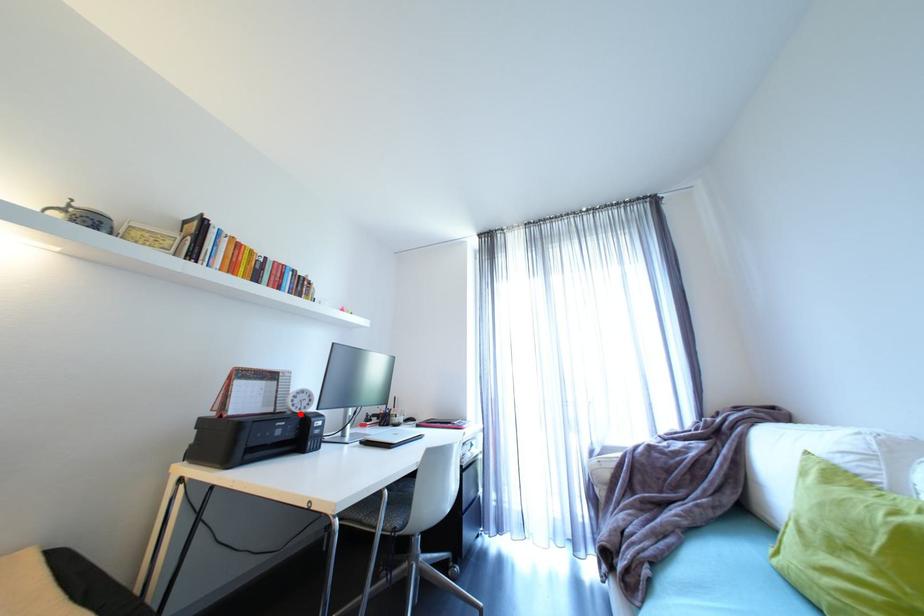
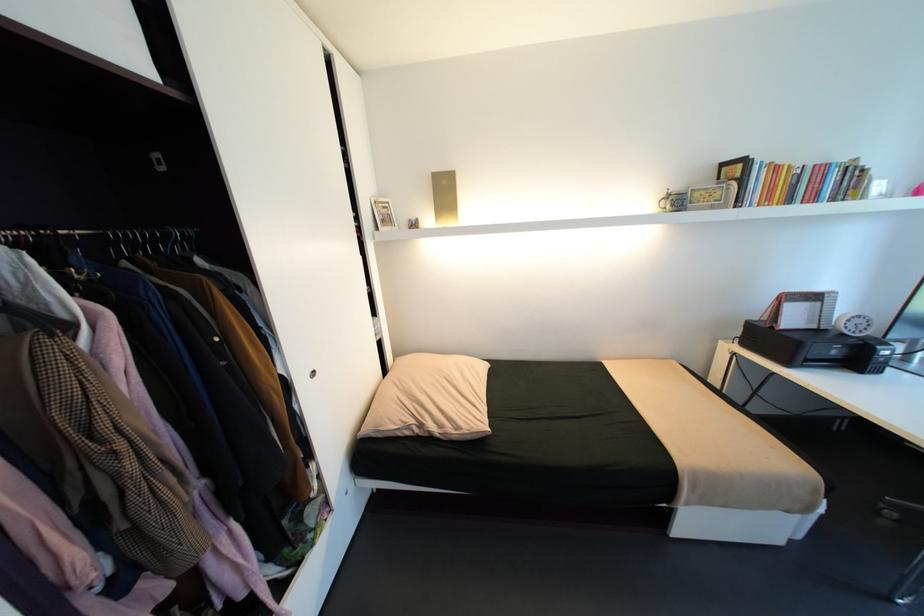
Question: I am providing you with two images of the same scene from different viewpoints. Given a red point in image1, look at the same physical point in image2. Is it:

Choices:
 (A) Closer to the viewpoint
 (B) Farther from the viewpoint

Answer: (A)